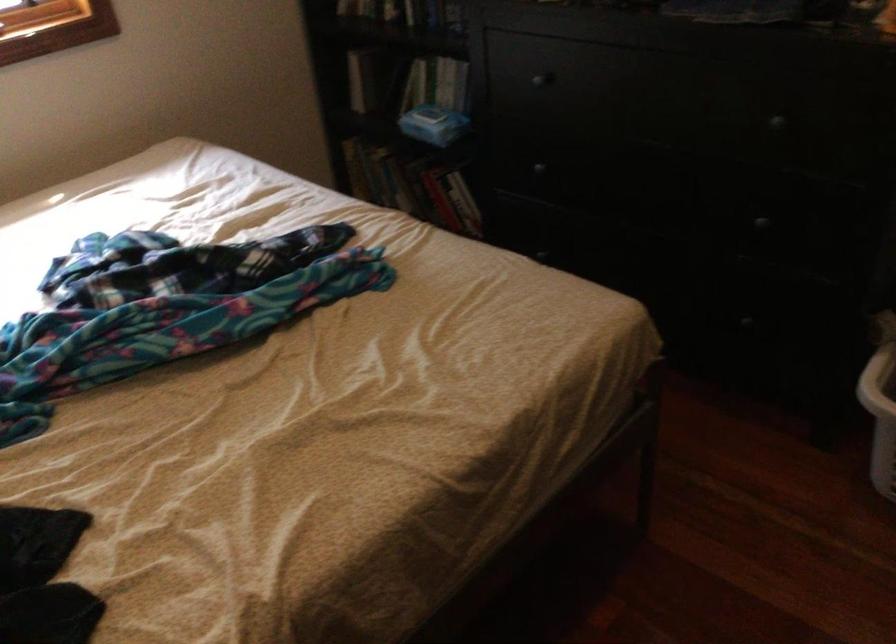
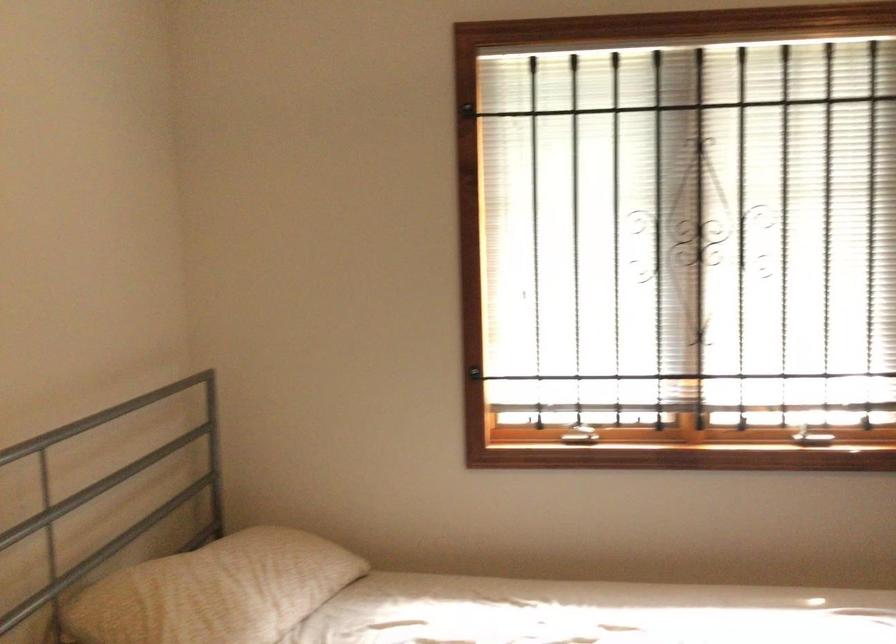
Question: How did the camera likely rotate?

Choices:
 (A) Left
 (B) Right
 (C) Up
 (D) Down

Answer: (A)